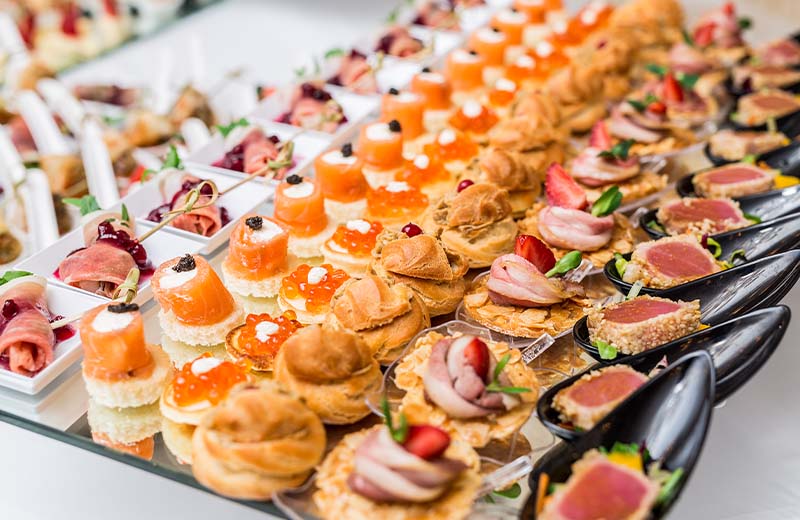
Where is `platter`? This screenshot has height=520, width=800. platter is located at coordinates (156, 464).